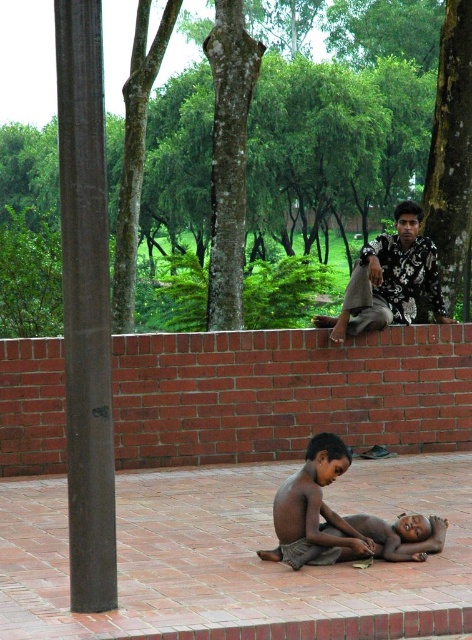
Is point (343, 317) in front of point (321, 448)?

That is False.

You are a GUI agent. You are given a task and a screenshot of the screen. Output one action in this format:
    pyautogui.click(x=<x>, y=<y>)
    Task: Click on the floral shirt at upper right
    
    Given the screenshot: What is the action you would take?
    pyautogui.click(x=394, y=278)

Can you confirm if green leafy tree at upper right is shorter than floral shirt at upper right?

No.

Does point (461, 234) come farther from viewer compared to point (399, 273)?

That is True.

Image resolution: width=472 pixels, height=640 pixels. What do you see at coordinates (451, 150) in the screenshot?
I see `green leafy tree at upper right` at bounding box center [451, 150].

At what (x,y) coordinates should I click in order to perform the action: click on green leafy tree at upper right. Please return your answer as a coordinate pair (x, y). Image resolution: width=472 pixels, height=640 pixels. Looking at the image, I should click on (451, 150).

Who is lower down, brown polished wood at left or floral shirt at upper right?

Positioned lower is brown polished wood at left.

Between brown polished wood at left and floral shirt at upper right, which one is positioned higher?

floral shirt at upper right

Where is `brown polished wood at left`? brown polished wood at left is located at coordinates (85, 307).